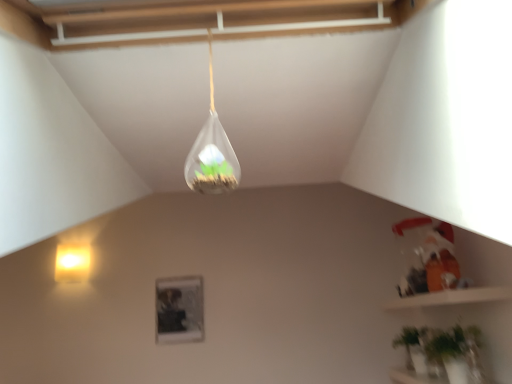
Question: Does transparent glass terrarium at upper center, which is the 1th lamp in top-to-bottom order, have a smaller size compared to matte yellow wall sconce at left, which is the second lamp in top-to-bottom order?

Choices:
 (A) no
 (B) yes

Answer: (B)

Question: Is transparent glass terrarium at upper center, the 2th lamp when ordered from left to right, at the right side of matte yellow wall sconce at left, acting as the 1th lamp starting from the back?

Choices:
 (A) yes
 (B) no

Answer: (A)

Question: From the image's perspective, is transparent glass terrarium at upper center, the 2th lamp when ordered from left to right, on matte yellow wall sconce at left, which is the second lamp in top-to-bottom order?

Choices:
 (A) yes
 (B) no

Answer: (A)

Question: From a real-world perspective, is transparent glass terrarium at upper center, the first lamp from the front, over matte yellow wall sconce at left, acting as the 2th lamp starting from the front?

Choices:
 (A) no
 (B) yes

Answer: (A)

Question: From the image's perspective, would you say transparent glass terrarium at upper center, which is the 1th lamp in top-to-bottom order, is shown under matte yellow wall sconce at left, which is the 1th lamp in bottom-to-top order?

Choices:
 (A) no
 (B) yes

Answer: (A)

Question: Can you confirm if transparent glass terrarium at upper center, the 2th lamp in the bottom-to-top sequence, is shorter than matte yellow wall sconce at left, which is the 1th lamp in bottom-to-top order?

Choices:
 (A) yes
 (B) no

Answer: (B)

Question: Is green matte plant at lower right turned away from transparent glass terrarium at upper center, the 2th lamp when ordered from left to right?

Choices:
 (A) yes
 (B) no

Answer: (B)

Question: Could you tell me if green matte plant at lower right is facing transparent glass terrarium at upper center, which is counted as the 2th lamp, starting from the back?

Choices:
 (A) no
 (B) yes

Answer: (A)

Question: Is green matte plant at lower right beside transparent glass terrarium at upper center, the first lamp from the front?

Choices:
 (A) yes
 (B) no

Answer: (B)

Question: From a real-world perspective, is green matte plant at lower right positioned over transparent glass terrarium at upper center, which is counted as the 2th lamp, starting from the back, based on gravity?

Choices:
 (A) no
 (B) yes

Answer: (A)

Question: Can you confirm if green matte plant at lower right is taller than transparent glass terrarium at upper center, the first lamp from the front?

Choices:
 (A) no
 (B) yes

Answer: (A)

Question: Can you confirm if green matte plant at lower right is wider than transparent glass terrarium at upper center, which is counted as the 2th lamp, starting from the back?

Choices:
 (A) no
 (B) yes

Answer: (B)

Question: From a real-world perspective, is transparent glass terrarium at upper center, the 2th lamp when ordered from left to right, positioned over green matte plant at lower right based on gravity?

Choices:
 (A) no
 (B) yes

Answer: (B)